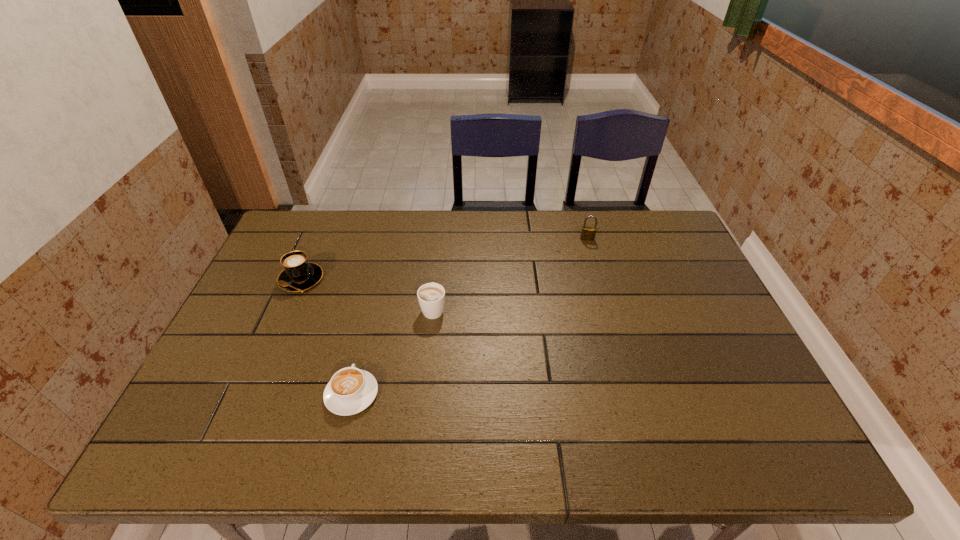
Find the location of a particular element. free space at the left edge is located at coordinates (295, 297).

Locate an element on the screen. The height and width of the screenshot is (540, 960). vacant space at the right edge is located at coordinates (762, 397).

Identify the location of vacant space at the far left corner of the desktop. This screenshot has width=960, height=540. (293, 228).

At what (x,y) coordinates should I click in order to perform the action: click on free space at the near left corner of the desktop. Please return your answer as a coordinate pair (x, y). Looking at the image, I should click on (210, 426).

The width and height of the screenshot is (960, 540). In the image, there is a desktop. In order to click on free region at the near right corner in this screenshot , I will do `click(786, 454)`.

You are a GUI agent. You are given a task and a screenshot of the screen. Output one action in this format:
    pyautogui.click(x=<x>, y=<y>)
    Task: Click on the free point between the second farthest object and the farthest object
    
    Given the screenshot: What is the action you would take?
    pyautogui.click(x=444, y=259)

Identify the location of free spot between the padlock and the nearest object. The height and width of the screenshot is (540, 960). (469, 316).

Identify the location of free space between the farthest cappuccino and the nearest cappuccino. (326, 336).

Locate an element on the screen. vacant point located between the second object from left to right and the farthest cappuccino is located at coordinates (326, 336).

Locate an element on the screen. This screenshot has width=960, height=540. vacant space that's between the second nearest object and the leftmost object is located at coordinates (367, 294).